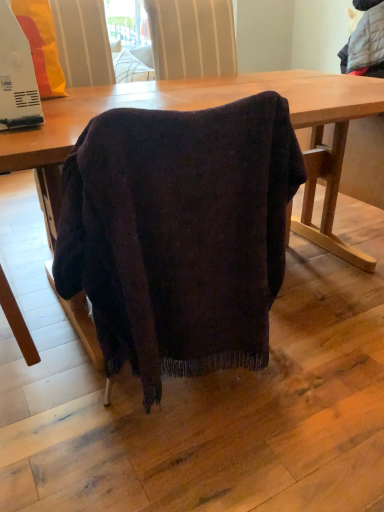
Question: From the image's perspective, is dark wood table at center under white plastic microwave at upper left?

Choices:
 (A) yes
 (B) no

Answer: (A)

Question: Can you confirm if dark wood table at center is wider than white plastic microwave at upper left?

Choices:
 (A) no
 (B) yes

Answer: (B)

Question: Is dark wood table at center aimed at white plastic microwave at upper left?

Choices:
 (A) yes
 (B) no

Answer: (B)

Question: From the image's perspective, does dark wood table at center appear higher than white plastic microwave at upper left?

Choices:
 (A) yes
 (B) no

Answer: (B)

Question: Is dark wood table at center far away from white plastic microwave at upper left?

Choices:
 (A) yes
 (B) no

Answer: (B)

Question: Is dark wood table at center at the right side of white plastic microwave at upper left?

Choices:
 (A) yes
 (B) no

Answer: (A)

Question: Does white plastic microwave at upper left have a lesser height compared to dark wood table at center?

Choices:
 (A) yes
 (B) no

Answer: (A)

Question: Does white plastic microwave at upper left come in front of dark wood table at center?

Choices:
 (A) no
 (B) yes

Answer: (A)

Question: Is dark wood table at center completely or partially inside white plastic microwave at upper left?

Choices:
 (A) no
 (B) yes

Answer: (A)

Question: Is white plastic microwave at upper left to the right of dark wood table at center from the viewer's perspective?

Choices:
 (A) no
 (B) yes

Answer: (A)

Question: Does white plastic microwave at upper left have a larger size compared to dark wood table at center?

Choices:
 (A) yes
 (B) no

Answer: (B)

Question: Are white plastic microwave at upper left and dark wood table at center far apart?

Choices:
 (A) yes
 (B) no

Answer: (B)

Question: In terms of height, does white plastic microwave at upper left look taller or shorter compared to dark wood table at center?

Choices:
 (A) short
 (B) tall

Answer: (A)